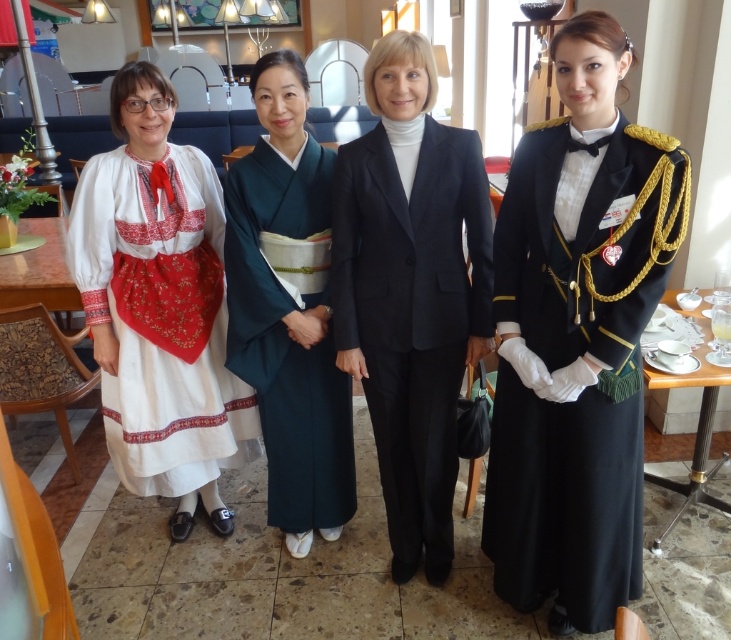
Is point (107, 326) closer to camera compared to point (471, 291)?

No, it is not.

Between white embroidered dress at left and navy blue woolen suit at center, which one appears on the right side from the viewer's perspective?

navy blue woolen suit at center

At what (x,y) coordinates should I click in order to perform the action: click on white embroidered dress at left. Please return your answer as a coordinate pair (x, y). The width and height of the screenshot is (731, 640). Looking at the image, I should click on (159, 307).

Which is below, shiny black uniform at right or teal silk kimono at center?

shiny black uniform at right

Is the position of shiny black uniform at right less distant than that of teal silk kimono at center?

Yes, it is.

Is point (564, 35) closer to camera compared to point (321, 330)?

Yes.

Identify the location of shiny black uniform at right. (577, 337).

Which of these two, shiny black uniform at right or navy blue woolen suit at center, stands shorter?

navy blue woolen suit at center

Which is behind, point (643, 438) or point (443, 509)?

The point (443, 509) is behind.

Find the location of a particular element. The image size is (731, 640). shiny black uniform at right is located at coordinates (577, 337).